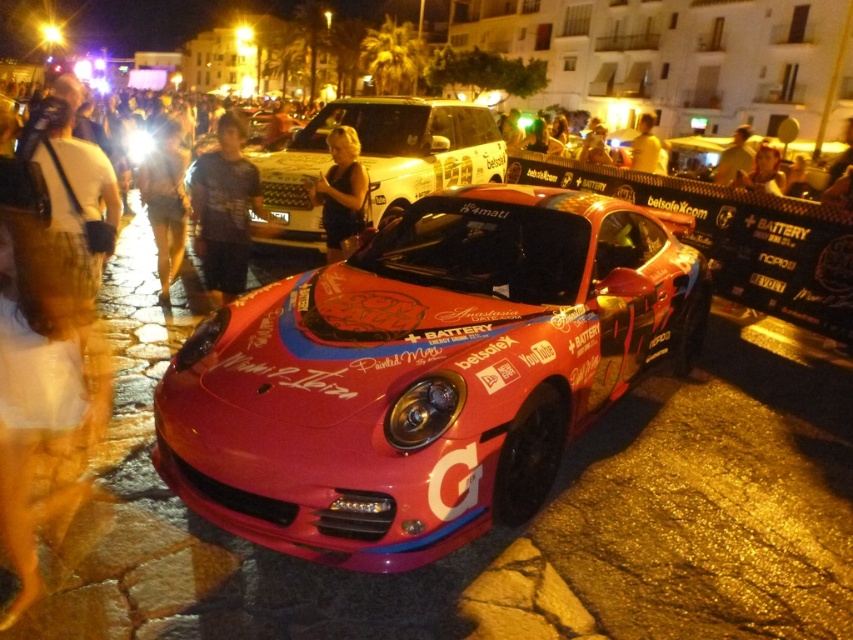
Question: In this image, where is shiny metallic sports car at center located relative to matte black shirt at center?

Choices:
 (A) left
 (B) right

Answer: (B)

Question: Does shiny metallic sports car at center have a lesser width compared to smooth skin face at upper right?

Choices:
 (A) yes
 (B) no

Answer: (B)

Question: Based on their relative distances, which object is farther from the smooth skin face at upper right?

Choices:
 (A) black plastic license plate at center
 (B) blue striped shirt at center
 (C) white glossy taxi at center
 (D) dark brown leather jacket at center

Answer: (B)

Question: Considering the real-world distances, which object is closest to the blue striped shirt at center?

Choices:
 (A) white glossy taxi at center
 (B) yellow t-shirt at upper center
 (C) matte black shirt at center

Answer: (C)

Question: Is the position of shiny metallic sports car at center more distant than that of dark brown leather jacket at center?

Choices:
 (A) no
 (B) yes

Answer: (A)

Question: Which point is closer to the camera?

Choices:
 (A) shiny metallic sports car at center
 (B) yellow fabric shirt at upper right
 (C) yellow t-shirt at upper center
 (D) white glossy taxi at center

Answer: (A)